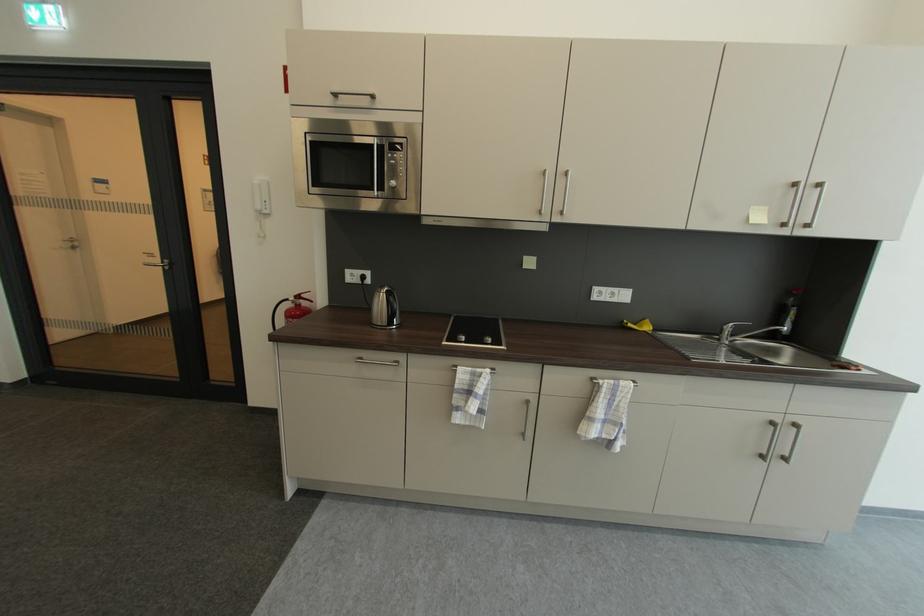
The height and width of the screenshot is (616, 924). What do you see at coordinates (392, 308) in the screenshot?
I see `the black kettle handle` at bounding box center [392, 308].